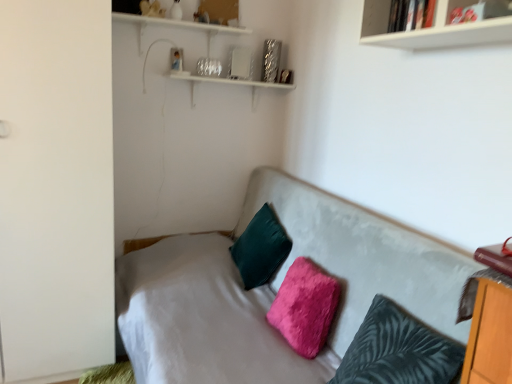
Question: Which direction should I rotate to look at fuzzy dark teal pillow at center, which is the 3th pillow from back to front?

Choices:
 (A) right
 (B) left

Answer: (A)

Question: Does white glossy bookshelf at upper right have a lesser width compared to white matte wardrobe at left?

Choices:
 (A) no
 (B) yes

Answer: (B)

Question: From the image's perspective, would you say white glossy bookshelf at upper right is shown under white matte wardrobe at left?

Choices:
 (A) no
 (B) yes

Answer: (A)

Question: Does white glossy bookshelf at upper right have a larger size compared to white matte wardrobe at left?

Choices:
 (A) no
 (B) yes

Answer: (A)

Question: From a real-world perspective, is white glossy bookshelf at upper right positioned over white matte wardrobe at left based on gravity?

Choices:
 (A) no
 (B) yes

Answer: (B)

Question: Considering the relative sizes of white glossy bookshelf at upper right and white matte wardrobe at left in the image provided, is white glossy bookshelf at upper right shorter than white matte wardrobe at left?

Choices:
 (A) no
 (B) yes

Answer: (B)

Question: Does white glossy bookshelf at upper right turn towards white matte wardrobe at left?

Choices:
 (A) yes
 (B) no

Answer: (B)

Question: From a real-world perspective, is fuzzy pink pillow at center, placed as the second pillow when sorted from back to front, under velvet gray couch at center?

Choices:
 (A) no
 (B) yes

Answer: (A)

Question: Can you confirm if fuzzy pink pillow at center, marked as the second pillow in a front-to-back arrangement, is smaller than velvet gray couch at center?

Choices:
 (A) yes
 (B) no

Answer: (A)

Question: From a real-world perspective, is fuzzy pink pillow at center, placed as the second pillow when sorted from back to front, on top of velvet gray couch at center?

Choices:
 (A) no
 (B) yes

Answer: (B)

Question: Is fuzzy pink pillow at center, placed as the second pillow when sorted from back to front, at the left side of velvet gray couch at center?

Choices:
 (A) no
 (B) yes

Answer: (A)

Question: Considering the relative sizes of fuzzy pink pillow at center, placed as the second pillow when sorted from back to front, and velvet gray couch at center in the image provided, is fuzzy pink pillow at center, placed as the second pillow when sorted from back to front, wider than velvet gray couch at center?

Choices:
 (A) no
 (B) yes

Answer: (A)

Question: Is fuzzy pink pillow at center, placed as the second pillow when sorted from back to front, at the right side of velvet gray couch at center?

Choices:
 (A) no
 (B) yes

Answer: (B)

Question: Considering the relative positions of fuzzy dark teal pillow at center, which is the 3th pillow from back to front, and white matte wardrobe at left in the image provided, is fuzzy dark teal pillow at center, which is the 3th pillow from back to front, behind white matte wardrobe at left?

Choices:
 (A) no
 (B) yes

Answer: (A)